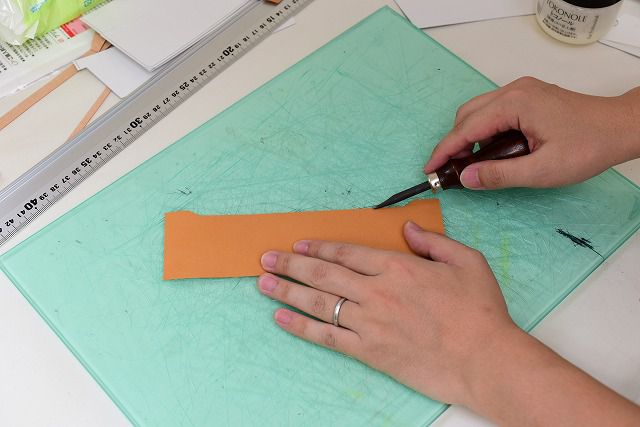
Where is `papers`? Image resolution: width=640 pixels, height=427 pixels. papers is located at coordinates (150, 29), (113, 67).